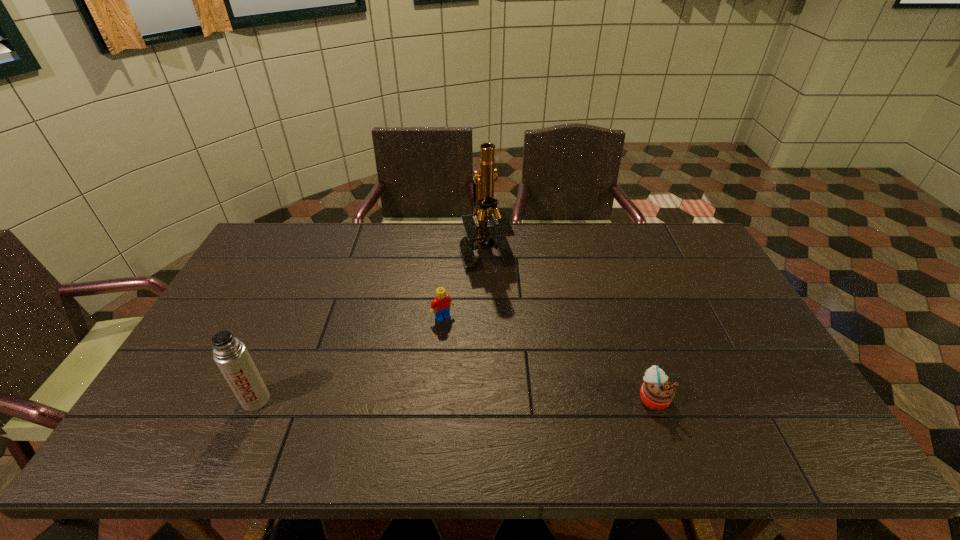
Identify the location of free spot on the desktop that is between the thermos bottle and the rightmost object and is positioned on the face of the third nearest object. (497, 399).

Where is `free space on the desktop that is between the leftmost object and the muffin and is positioned at the eyepiece of the tallest object`? This screenshot has width=960, height=540. free space on the desktop that is between the leftmost object and the muffin and is positioned at the eyepiece of the tallest object is located at coordinates (437, 399).